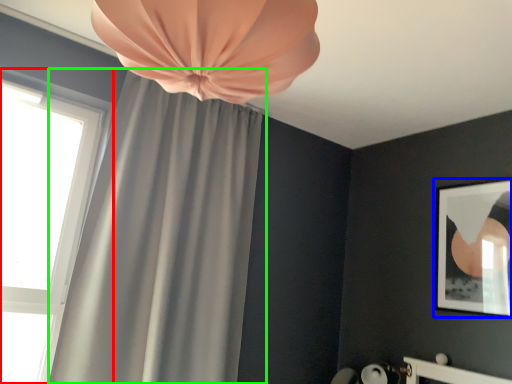
Question: Which is farther away from window (highlighted by a red box)? picture frame (highlighted by a blue box) or curtain (highlighted by a green box)?

Choices:
 (A) picture frame
 (B) curtain

Answer: (A)